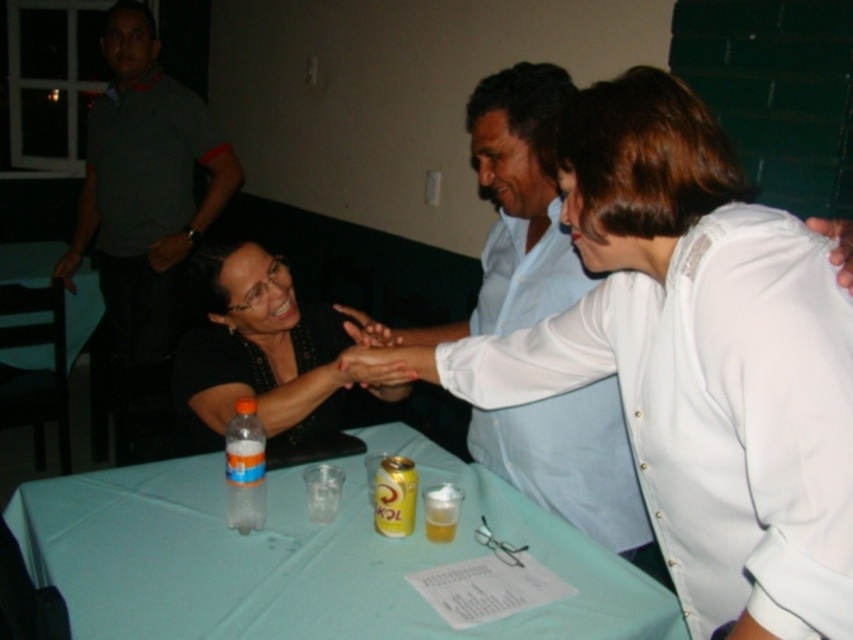
Question: Can you confirm if black matte shirt at center is positioned to the right of translucent plastic bottle at table left?

Choices:
 (A) yes
 (B) no

Answer: (A)

Question: Does black matte shirt at center have a smaller size compared to translucent plastic bottle at table left?

Choices:
 (A) yes
 (B) no

Answer: (B)

Question: Which object is the farthest from the green plastic table at lower left?

Choices:
 (A) white matte shirt at center
 (B) translucent plastic bottle at table left
 (C) dark gray polo shirt at upper left
 (D) black matte shirt at center

Answer: (A)

Question: Which object is the farthest from the dark gray polo shirt at upper left?

Choices:
 (A) black matte shirt at center
 (B) translucent plastic bottle at table left
 (C) green plastic table at lower left

Answer: (B)

Question: Which point appears closest to the camera in this image?

Choices:
 (A) (392, 340)
 (B) (233, 468)

Answer: (B)

Question: Is light blue fabric table at lower center to the left of green plastic table at lower left from the viewer's perspective?

Choices:
 (A) yes
 (B) no

Answer: (B)